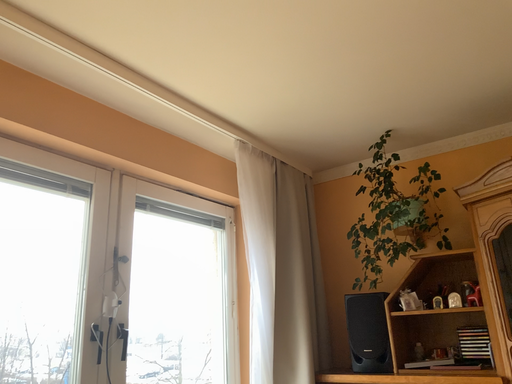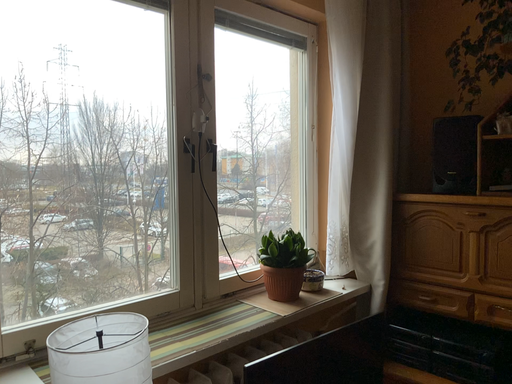
Question: How did the camera likely rotate when shooting the video?

Choices:
 (A) rotated left
 (B) rotated right

Answer: (A)